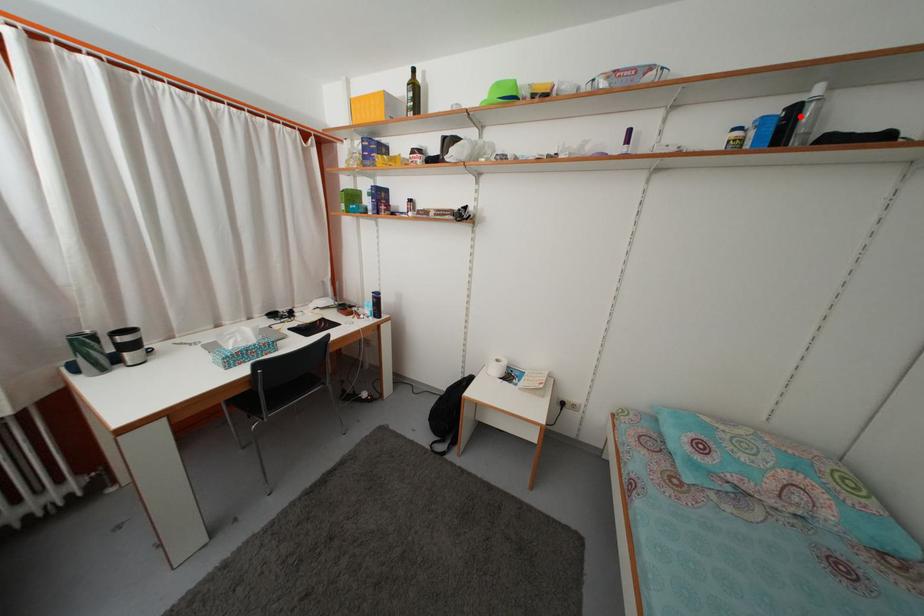
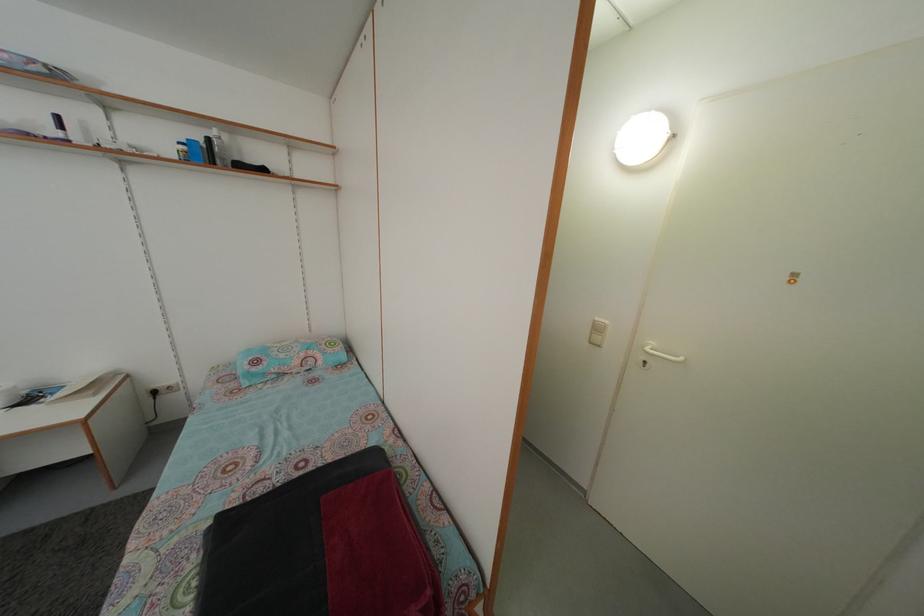
Find the pixel in the second image that matches the highlighted location in the first image.

(214, 148)